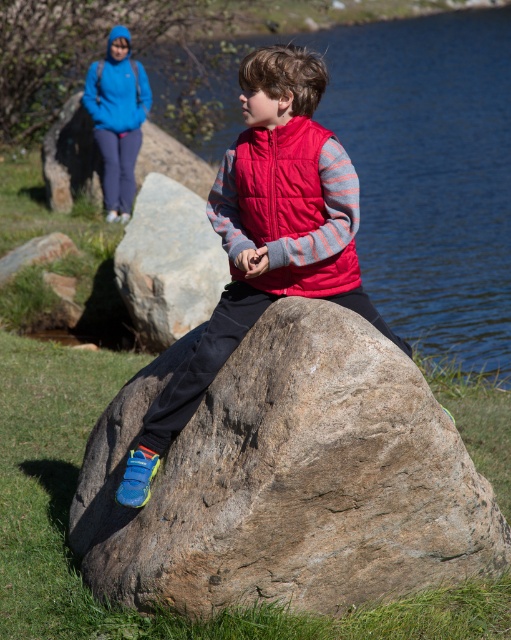
You are a hiker who wants to climb the highest boulder in the scene. Which one should you choose between the brown rough boulder at center and the gray rough boulder at center?

The gray rough boulder at center is taller than the brown rough boulder at center, so you should choose the gray rough boulder at center to climb as it is the highest one.

You are a photographer trying to capture a closeup of the red puffy vest at center and the gray rough boulder at center. Given that your camera lens can only focus on objects within a 1.2 meter width, will both objects fit in the frame?

The red puffy vest at center is wider than the gray rough boulder at center. Since the total width of both objects combined may exceed the camera lens limit of 1.2 meters, it is possible that they won

You are a photographer trying to capture both the brown rough boulder at center and the red puffy vest at center in a single frame. Given their sizes, which object will occupy more space in the photo?

The brown rough boulder at center will occupy more space in the photo since its width surpasses that of the red puffy vest at center.